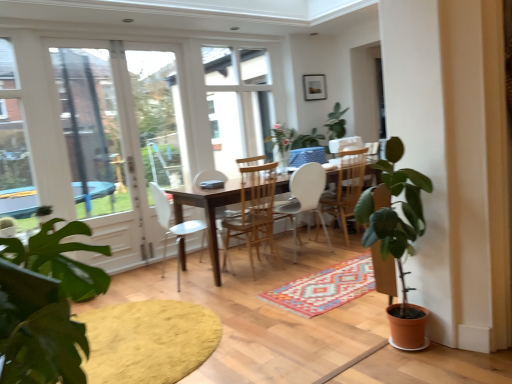
What are the coordinates of `free area in between white plastic chair at center, the 4th chair in the right-to-left sequence, and yellow felt mat at lower center` in the screenshot? It's located at click(x=193, y=293).